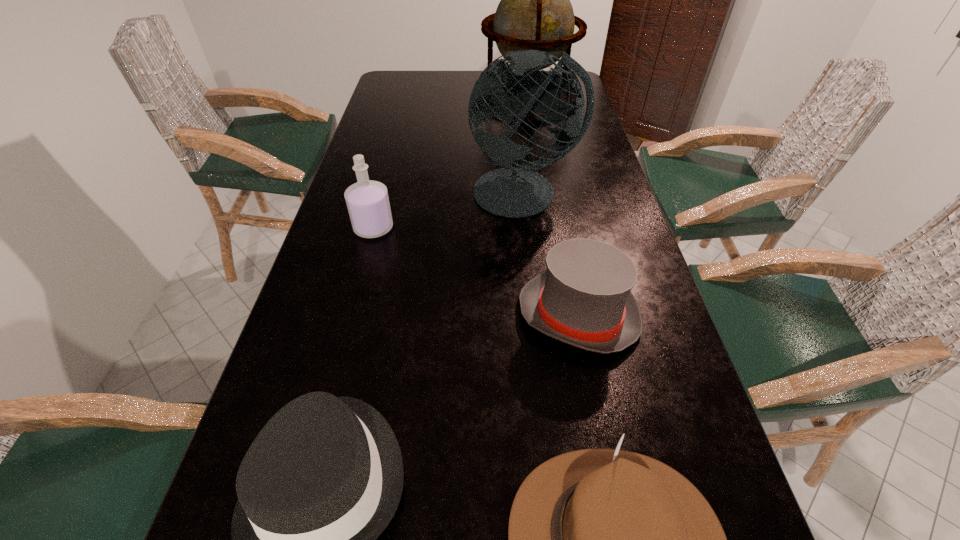
At what (x,y) coordinates should I click in order to perform the action: click on dress hat that is at the right edge. Please return your answer as a coordinate pair (x, y). The height and width of the screenshot is (540, 960). Looking at the image, I should click on (583, 298).

Locate an element on the screen. This screenshot has width=960, height=540. object that is positioned at the far right corner is located at coordinates (535, 13).

The height and width of the screenshot is (540, 960). What are the coordinates of `free space at the left edge` in the screenshot? It's located at (396, 194).

In the image, there is a desktop. In order to click on blank space at the right edge in this screenshot , I will do `click(617, 219)`.

This screenshot has width=960, height=540. In order to click on vacant area that lies between the farther globe and the perfume in this screenshot , I will do `click(451, 163)`.

Identify which object is the third nearest to the perfume. Please provide its 2D coordinates. Your answer should be formatted as a tuple, i.e. [(x, y)], where the tuple contains the x and y coordinates of a point satisfying the conditions above.

[(322, 480)]

This screenshot has height=540, width=960. I want to click on object that stands as the second closest to the right fedora, so click(583, 298).

Find the location of a particular element. The width and height of the screenshot is (960, 540). vacant space that satisfies the following two spatial constraints: 1. on the front-facing side of the nearer globe; 2. on the left side of the dress hat is located at coordinates (539, 315).